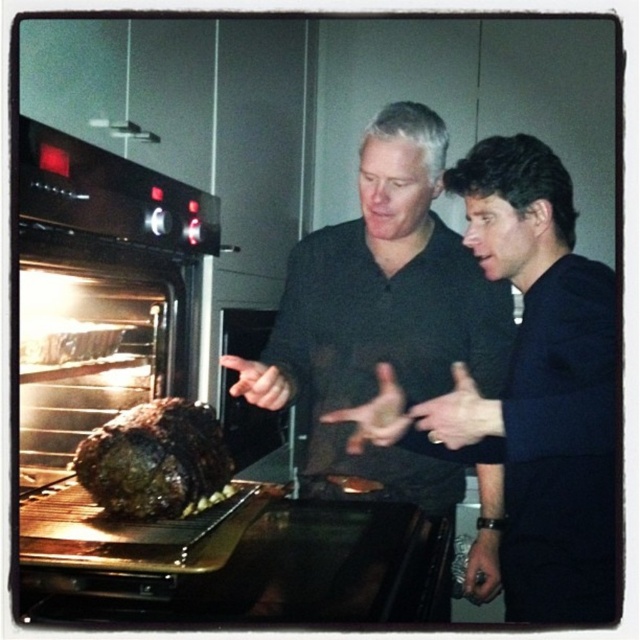
You are a guest at a dinner party and see the dark blue shirt at center and the brown crispy turkey at center. Which one is closer to you?

The dark blue shirt at center is closer to you because it is in front of the brown crispy turkey at center.